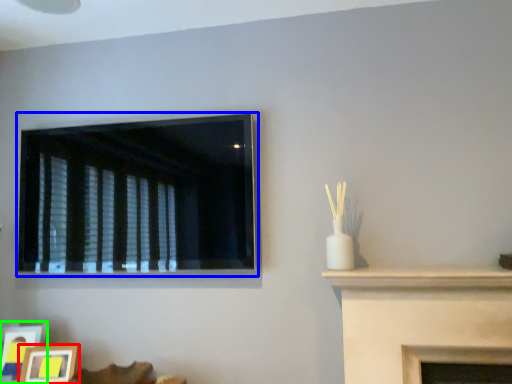
Question: Which is farther away from picture frame (highlighted by a red box)? window (highlighted by a blue box) or picture frame (highlighted by a green box)?

Choices:
 (A) window
 (B) picture frame

Answer: (A)